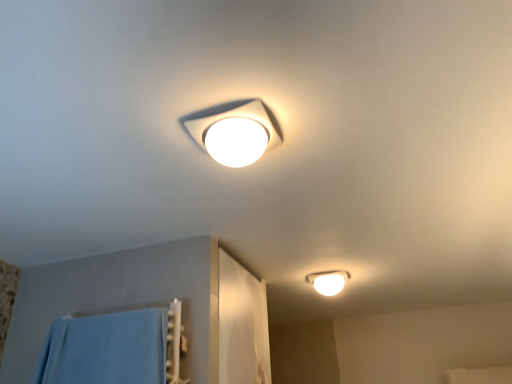
Question: Can you confirm if white matte lamp at upper center, arranged as the 2th lamp when viewed from the back, is taller than white glossy light fixture at lower right, which is counted as the first lamp, starting from the right?

Choices:
 (A) no
 (B) yes

Answer: (A)

Question: Does white matte lamp at upper center, which is counted as the 2th lamp, starting from the bottom, have a lesser height compared to white glossy light fixture at lower right, which ranks as the 2th lamp in front-to-back order?

Choices:
 (A) no
 (B) yes

Answer: (B)

Question: Considering the relative positions of white matte lamp at upper center, the 1th lamp when ordered from top to bottom, and white glossy light fixture at lower right, which is counted as the first lamp, starting from the right, in the image provided, is white matte lamp at upper center, the 1th lamp when ordered from top to bottom, in front of white glossy light fixture at lower right, which is counted as the first lamp, starting from the right,?

Choices:
 (A) yes
 (B) no

Answer: (A)

Question: Does white matte lamp at upper center, the 1th lamp when ordered from top to bottom, turn towards white glossy light fixture at lower right, marked as the 1th lamp in a back-to-front arrangement?

Choices:
 (A) yes
 (B) no

Answer: (A)

Question: Is white matte lamp at upper center, which appears as the first lamp when viewed from the front, positioned with its back to white glossy light fixture at lower right, which ranks as the 2th lamp in front-to-back order?

Choices:
 (A) no
 (B) yes

Answer: (A)

Question: From a real-world perspective, is white matte lamp at upper center, arranged as the 2th lamp when viewed from the back, below white glossy light fixture at lower right, which is counted as the first lamp, starting from the right?

Choices:
 (A) no
 (B) yes

Answer: (B)

Question: Considering the relative sizes of white glossy light fixture at lower right, which is counted as the second lamp, starting from the left, and white matte lamp at upper center, which appears as the first lamp when viewed from the front, in the image provided, is white glossy light fixture at lower right, which is counted as the second lamp, starting from the left, smaller than white matte lamp at upper center, which appears as the first lamp when viewed from the front,?

Choices:
 (A) yes
 (B) no

Answer: (B)

Question: Is white matte lamp at upper center, arranged as the 2th lamp when viewed from the back, surrounded by white glossy light fixture at lower right, marked as the 1th lamp in a back-to-front arrangement?

Choices:
 (A) no
 (B) yes

Answer: (A)

Question: Is white glossy light fixture at lower right, which ranks as the 2th lamp in front-to-back order, not close to white matte lamp at upper center, the 1th lamp when ordered from top to bottom?

Choices:
 (A) no
 (B) yes

Answer: (B)

Question: Is white glossy light fixture at lower right, which ranks as the 1th lamp in bottom-to-top order, to the right of white matte lamp at upper center, which is counted as the 2th lamp, starting from the bottom, from the viewer's perspective?

Choices:
 (A) yes
 (B) no

Answer: (A)

Question: Considering the relative positions of white glossy light fixture at lower right, which is counted as the second lamp, starting from the left, and white matte lamp at upper center, arranged as the 2th lamp when viewed from the back, in the image provided, is white glossy light fixture at lower right, which is counted as the second lamp, starting from the left, to the left of white matte lamp at upper center, arranged as the 2th lamp when viewed from the back, from the viewer's perspective?

Choices:
 (A) yes
 (B) no

Answer: (B)

Question: Can you confirm if white glossy light fixture at lower right, which ranks as the 2th lamp in front-to-back order, is shorter than white matte lamp at upper center, positioned as the 1th lamp in left-to-right order?

Choices:
 (A) yes
 (B) no

Answer: (B)

Question: From a real-world perspective, relative to white glossy light fixture at lower right, marked as the 1th lamp in a back-to-front arrangement, is white matte lamp at upper center, which is counted as the 2th lamp, starting from the bottom, vertically above or below?

Choices:
 (A) below
 (B) above

Answer: (A)